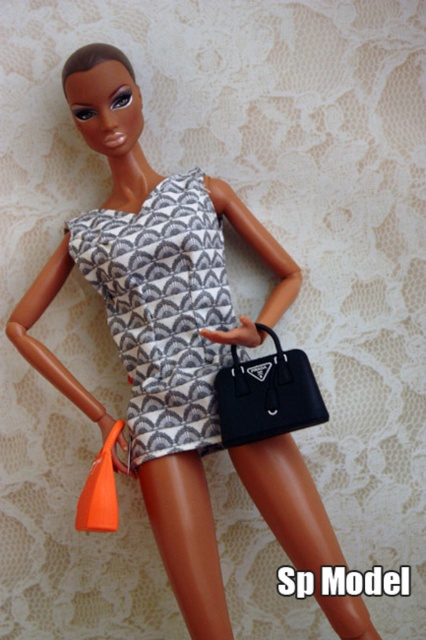
Does quilted gray dress at center have a greater width compared to matte black handbag at lower center?

Indeed, quilted gray dress at center has a greater width compared to matte black handbag at lower center.

Who is more forward, (158, 224) or (288, 426)?

Point (288, 426)

Is point (137, 340) positioned behind point (301, 381)?

Yes, it is.

The image size is (426, 640). In order to click on quilted gray dress at center in this screenshot , I will do `click(163, 308)`.